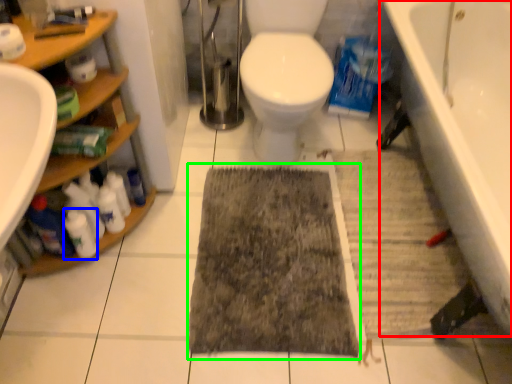
Question: Which object is positioned farthest from bathtub (highlighted by a red box)? Select from cleaning product (highlighted by a blue box) and doormat (highlighted by a green box).

Choices:
 (A) cleaning product
 (B) doormat

Answer: (A)